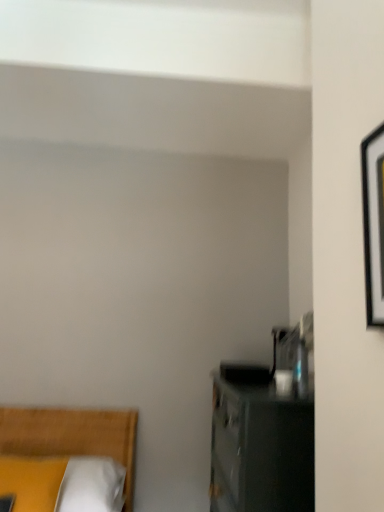
Question: Is yellow fabric pillow at lower left further to the viewer compared to yellow fabric bed at lower left?

Choices:
 (A) no
 (B) yes

Answer: (A)

Question: Considering the relative sizes of yellow fabric pillow at lower left and yellow fabric bed at lower left in the image provided, is yellow fabric pillow at lower left thinner than yellow fabric bed at lower left?

Choices:
 (A) no
 (B) yes

Answer: (B)

Question: From the image's perspective, is yellow fabric pillow at lower left located beneath yellow fabric bed at lower left?

Choices:
 (A) no
 (B) yes

Answer: (A)

Question: Does yellow fabric pillow at lower left have a greater width compared to yellow fabric bed at lower left?

Choices:
 (A) no
 (B) yes

Answer: (A)

Question: Can you confirm if yellow fabric pillow at lower left is shorter than yellow fabric bed at lower left?

Choices:
 (A) yes
 (B) no

Answer: (A)

Question: From the image's perspective, is yellow fabric pillow at lower left on top of yellow fabric bed at lower left?

Choices:
 (A) yes
 (B) no

Answer: (A)

Question: Is yellow fabric bed at lower left placed right next to black matte picture frame at right?

Choices:
 (A) no
 (B) yes

Answer: (A)

Question: From the image's perspective, does yellow fabric bed at lower left appear lower than black matte picture frame at right?

Choices:
 (A) yes
 (B) no

Answer: (A)

Question: From a real-world perspective, is yellow fabric bed at lower left under black matte picture frame at right?

Choices:
 (A) no
 (B) yes

Answer: (B)

Question: Considering the relative positions of yellow fabric bed at lower left and black matte picture frame at right in the image provided, is yellow fabric bed at lower left to the left of black matte picture frame at right from the viewer's perspective?

Choices:
 (A) yes
 (B) no

Answer: (A)

Question: Would you consider yellow fabric bed at lower left to be distant from black matte picture frame at right?

Choices:
 (A) yes
 (B) no

Answer: (A)

Question: From the image's perspective, is yellow fabric bed at lower left on black matte picture frame at right?

Choices:
 (A) no
 (B) yes

Answer: (A)

Question: Does yellow fabric pillow at lower left have a smaller size compared to black matte picture frame at right?

Choices:
 (A) yes
 (B) no

Answer: (B)